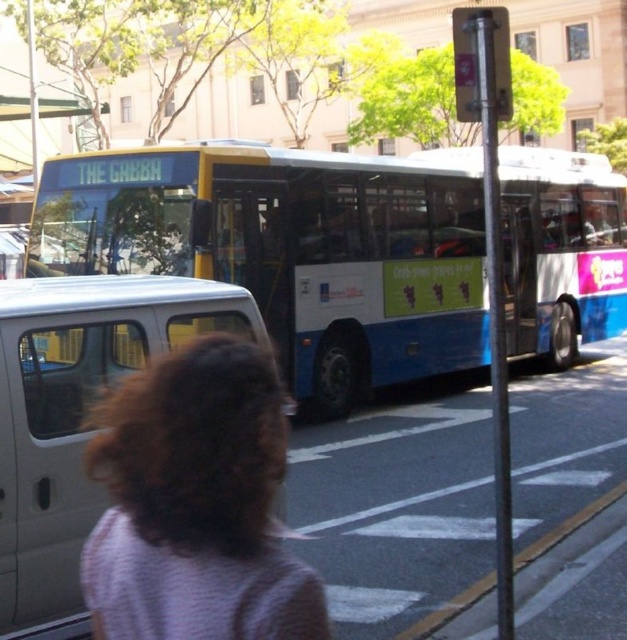
Which of these two, blue matte bus at center or white matte van at left, stands shorter?

white matte van at left

Does blue matte bus at center have a lesser width compared to white matte van at left?

In fact, blue matte bus at center might be wider than white matte van at left.

Which is in front, point (270, 275) or point (50, 474)?

Point (50, 474)

Where is `blue matte bus at center`? The width and height of the screenshot is (627, 640). blue matte bus at center is located at coordinates (292, 250).